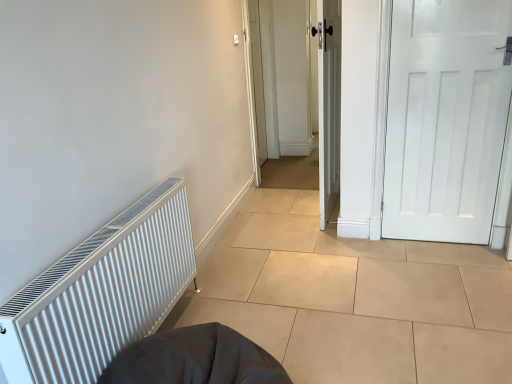
You are a GUI agent. You are given a task and a screenshot of the screen. Output one action in this format:
    pyautogui.click(x=<x>, y=<y>)
    Task: Click on the free space to the left of white matte door at right, arranged as the 1th door when viewed from the right
    
    Given the screenshot: What is the action you would take?
    pyautogui.click(x=388, y=253)